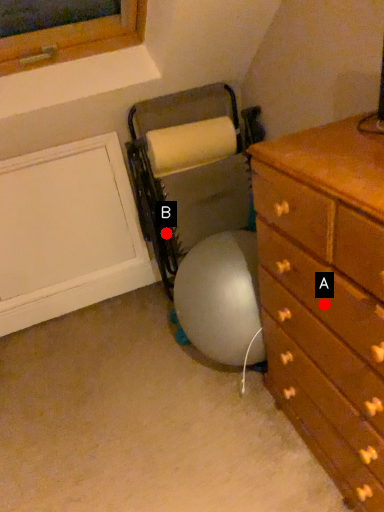
Question: Two points are circled on the image, labeled by A and B beside each circle. Among these points, which one is farthest from the camera?

Choices:
 (A) A is further
 (B) B is further

Answer: (B)